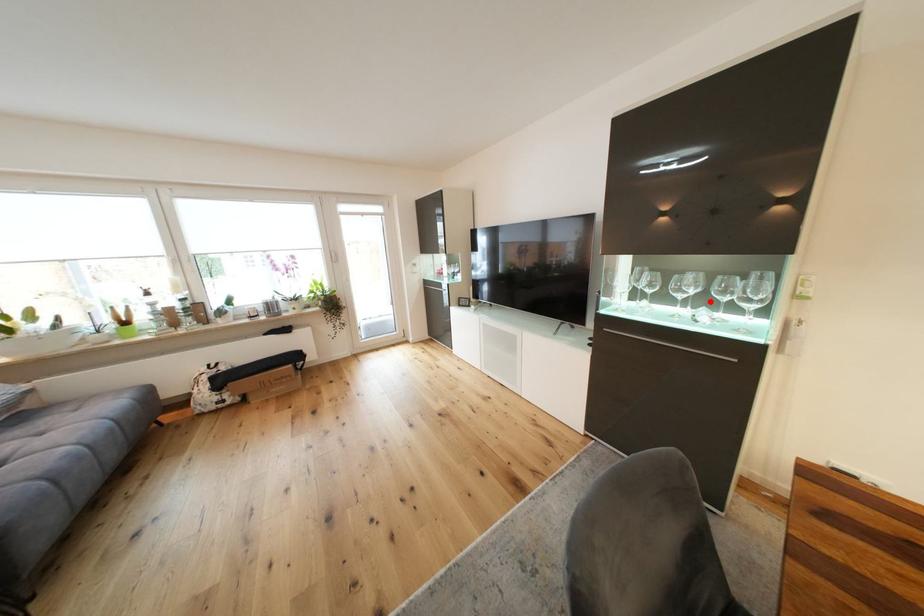
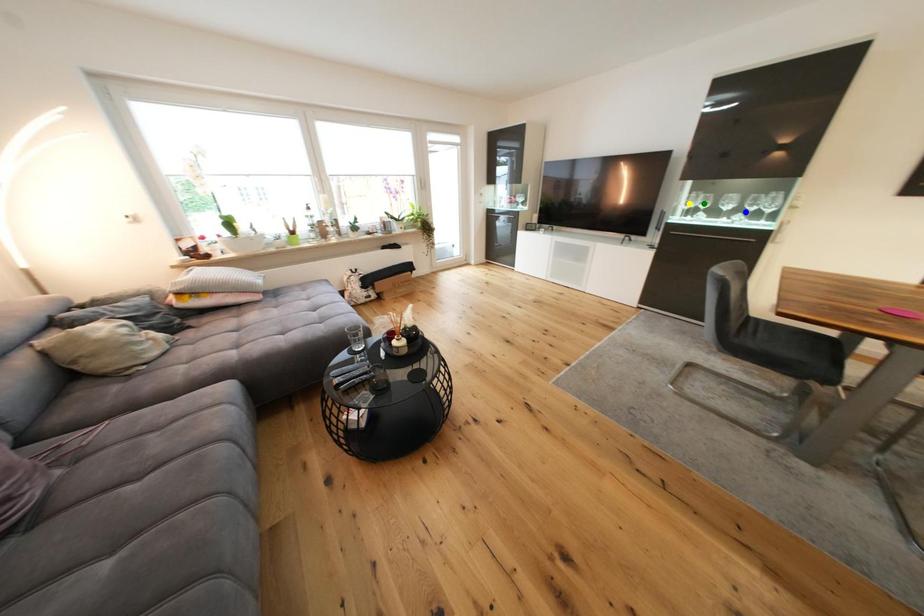
Question: I am providing you with two images of the same scene from different viewpoints. A red point is marked on the first image. You are given multiple points on the second image. Which point in image 2 represents the same 3d spot as the red point in image 1?

Choices:
 (A) green point
 (B) blue point
 (C) yellow point

Answer: (B)